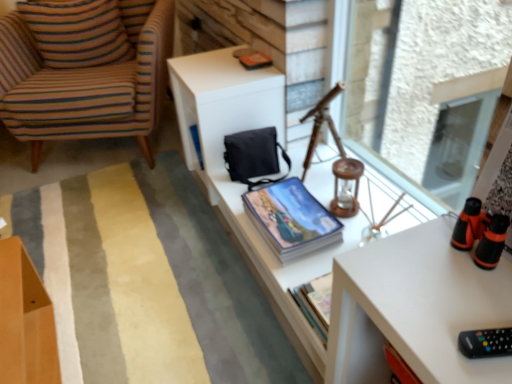
In order to face black plastic remote at lower right, should I rotate leftwards or rightwards?

Turn right approximately 20.917 degrees to face it.

Describe the element at coordinates (291, 219) in the screenshot. The image size is (512, 384). I see `blue glossy book at center` at that location.

What is the approximate height of transparent glass window screen at upper right?

28.09 inches.

Measure the distance between striped fabric armchair at left and camera.

striped fabric armchair at left and camera are 5.90 feet apart.

You are a GUI agent. You are given a task and a screenshot of the screen. Output one action in this format:
    pyautogui.click(x=<x>, y=<y>)
    Task: Click on the striped fabric pillow at left
    The height and width of the screenshot is (384, 512).
    Given the screenshot: What is the action you would take?
    pyautogui.click(x=77, y=32)

Identify the location of black plastic remote at lower right. Image resolution: width=512 pixels, height=384 pixels. (415, 308).

From a real-world perspective, is matte blue magazine at upper center located higher than blue glossy book at center?

Yes, from a real-world perspective, matte blue magazine at upper center is over blue glossy book at center

Looking at their sizes, would you say matte blue magazine at upper center is wider or thinner than blue glossy book at center?

Clearly, matte blue magazine at upper center has less width compared to blue glossy book at center.

Looking at this image, between matte blue magazine at upper center and blue glossy book at center, which one is positioned behind?

matte blue magazine at upper center is behind.

Is blue glossy book at center surrounded by matte blue magazine at upper center?

No, blue glossy book at center is not surrounded by matte blue magazine at upper center.

Is the depth of matte blue magazine at upper center less than that of striped fabric armchair at left?

No, it is not.

In the scene shown: Can you see matte blue magazine at upper center touching striped fabric armchair at left?

No, matte blue magazine at upper center is not next to striped fabric armchair at left.

Visually, is matte blue magazine at upper center positioned to the left or to the right of striped fabric armchair at left?

Clearly, matte blue magazine at upper center is on the right of striped fabric armchair at left in the image.

Considering the positions of points (251, 60) and (137, 8), is point (251, 60) closer to camera compared to point (137, 8)?

Yes.

From a real-world perspective, between white matte table at center and blue glossy book at center, who is vertically higher?

From a 3D spatial view, white matte table at center is above.

From the image's perspective, is white matte table at center located above blue glossy book at center?

Correct, white matte table at center appears higher than blue glossy book at center in the image.

Is white matte table at center turned away from blue glossy book at center?

Yes, blue glossy book at center is at the back of white matte table at center.

Would you say white matte table at center is outside blue glossy book at center?

Absolutely, white matte table at center is external to blue glossy book at center.

Which point is more distant from viewer, (287, 355) or (418, 222)?

The point (287, 355) is farther from the camera.

Can you confirm if soft striped rug at center is thinner than white matte table at center?

Incorrect, the width of soft striped rug at center is not less than that of white matte table at center.

Which is correct: soft striped rug at center is inside white matte table at center, or outside of it?

The correct answer is: outside.

From the picture: From a real-world perspective, is soft striped rug at center below white matte table at center?

Correct, in the physical world, soft striped rug at center is lower than white matte table at center.

Is point (133, 55) farther from camera compared to point (240, 194)?

Yes, it is.

Which of these two, striped fabric pillow at left or white matte table at center, stands taller?

white matte table at center is taller.

Can you tell me how much striped fabric pillow at left and white matte table at center differ in facing direction?

The angle between the facing direction of striped fabric pillow at left and the facing direction of white matte table at center is 77.3 degrees.

Who is shorter, transparent glass window screen at upper right or matte blue magazine at upper center?

matte blue magazine at upper center.

Is transparent glass window screen at upper right positioned beyond the bounds of matte blue magazine at upper center?

Yes, transparent glass window screen at upper right is located beyond the bounds of matte blue magazine at upper center.

Considering the relative positions of transparent glass window screen at upper right and matte blue magazine at upper center in the image provided, is transparent glass window screen at upper right to the left or to the right of matte blue magazine at upper center?

Based on their positions, transparent glass window screen at upper right is located to the right of matte blue magazine at upper center.

Consider the image. From the image's perspective, is soft striped rug at center under black plastic remote at lower right?

No.

Is soft striped rug at center bigger or smaller than black plastic remote at lower right?

Considering their sizes, soft striped rug at center takes up more space than black plastic remote at lower right.

Are soft striped rug at center and black plastic remote at lower right making contact?

No.

Is black plastic remote at lower right a part of soft striped rug at center?

No, black plastic remote at lower right is not inside soft striped rug at center.

Locate an element on the screen. book on the right of matte blue magazine at upper center is located at coordinates (291, 219).

This screenshot has width=512, height=384. I want to click on chair located in front of the matte blue magazine at upper center, so click(x=86, y=84).

Based on their spatial positions, is striped fabric armchair at left or blue glossy book at center closer to white matte table at center?

blue glossy book at center.

Based on their spatial positions, is white matte table at center or striped fabric pillow at left further from striped fabric armchair at left?

Based on the image, white matte table at center appears to be further to striped fabric armchair at left.

Considering their positions, is matte blue magazine at upper center positioned closer to soft striped rug at center than white matte table at center?

The object closer to soft striped rug at center is white matte table at center.

Looking at the image, which one is located closer to matte blue magazine at upper center, transparent glass window screen at upper right or blue glossy book at center?

Among the two, blue glossy book at center is located nearer to matte blue magazine at upper center.

From the image, which object appears to be farther from blue glossy book at center, black plastic remote at lower right or white matte table at center?

black plastic remote at lower right lies further to blue glossy book at center than the other object.

Looking at the image, which one is located further to transparent glass window screen at upper right, striped fabric pillow at left or white matte table at center?

striped fabric pillow at left is positioned further to the anchor transparent glass window screen at upper right.

When comparing their distances from blue glossy book at center, does white matte table at center or striped fabric armchair at left seem closer?

white matte table at center is positioned closer to the anchor blue glossy book at center.

Estimate the real-world distances between objects in this image. Which object is closer to matte blue magazine at upper center, white matte table at center or striped fabric armchair at left?

Based on the image, white matte table at center appears to be nearer to matte blue magazine at upper center.

Locate an element on the screen. This screenshot has width=512, height=384. magazine located between striped fabric armchair at left and transparent glass window screen at upper right in the left-right direction is located at coordinates (255, 61).

Identify the location of book between soft striped rug at center and black plastic remote at lower right in the horizontal direction. The width and height of the screenshot is (512, 384). (291, 219).

Locate an element on the screen. book located between striped fabric armchair at left and transparent glass window screen at upper right in the left-right direction is located at coordinates (291, 219).

You are a GUI agent. You are given a task and a screenshot of the screen. Output one action in this format:
    pyautogui.click(x=<x>, y=<y>)
    Task: Click on the plain between striped fabric pillow at left and black plastic remote at lower right from top to bottom
    Image resolution: width=512 pixels, height=384 pixels.
    Given the screenshot: What is the action you would take?
    pyautogui.click(x=147, y=281)